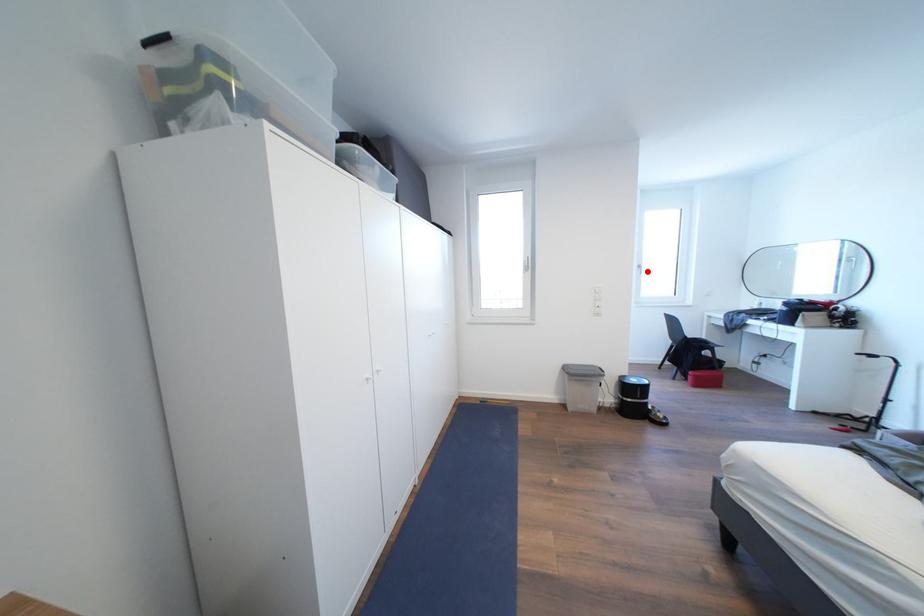
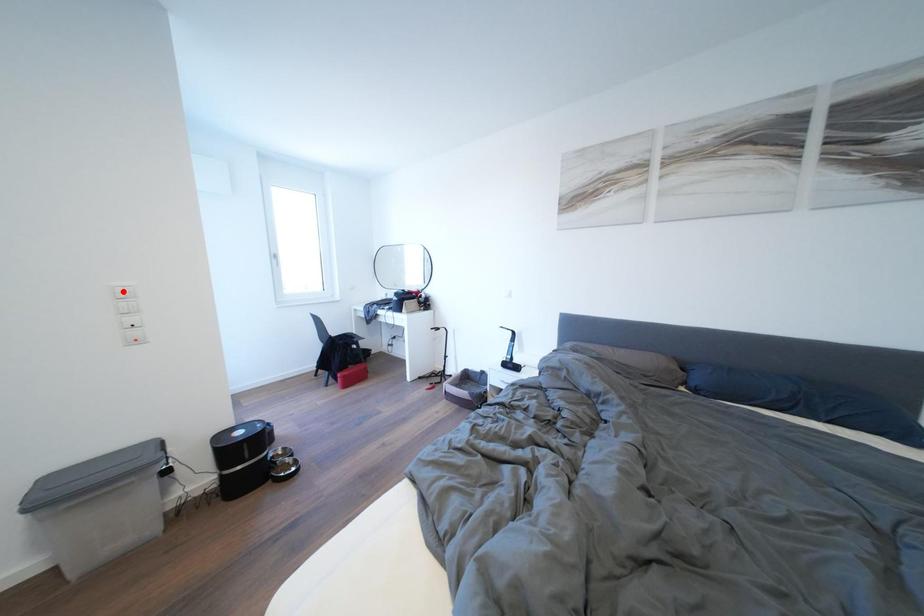
I am providing you with two images of the same scene from different viewpoints. A red point is marked on the first image and another point is marked on the second image. Is the red point in image1 aligned with the point shown in image2?

No